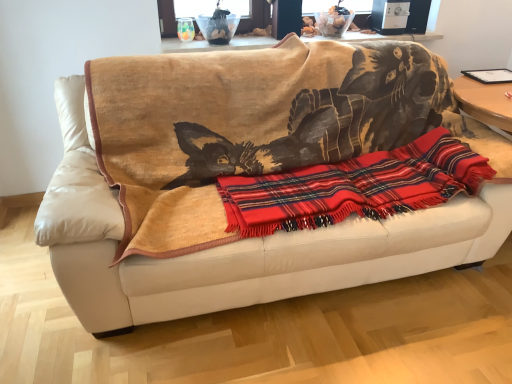
Question: From a real-world perspective, is red plaid blanket at center physically above wooden table at upper center?

Choices:
 (A) no
 (B) yes

Answer: (A)

Question: Is red plaid blanket at center next to wooden table at upper center and touching it?

Choices:
 (A) yes
 (B) no

Answer: (B)

Question: Is red plaid blanket at center oriented towards wooden table at upper center?

Choices:
 (A) yes
 (B) no

Answer: (B)

Question: Is red plaid blanket at center turned away from wooden table at upper center?

Choices:
 (A) yes
 (B) no

Answer: (B)

Question: From a real-world perspective, is red plaid blanket at center beneath wooden table at upper center?

Choices:
 (A) yes
 (B) no

Answer: (A)

Question: Does red plaid blanket at center appear on the left side of wooden table at upper center?

Choices:
 (A) yes
 (B) no

Answer: (B)

Question: Considering the relative positions of red plaid blanket at center and beige leather couch at center in the image provided, is red plaid blanket at center to the right of beige leather couch at center from the viewer's perspective?

Choices:
 (A) yes
 (B) no

Answer: (A)

Question: From the image's perspective, is red plaid blanket at center beneath beige leather couch at center?

Choices:
 (A) yes
 (B) no

Answer: (A)

Question: Is red plaid blanket at center closer to camera compared to beige leather couch at center?

Choices:
 (A) yes
 (B) no

Answer: (B)

Question: Is red plaid blanket at center not within beige leather couch at center?

Choices:
 (A) no
 (B) yes

Answer: (A)

Question: Is red plaid blanket at center taller than beige leather couch at center?

Choices:
 (A) yes
 (B) no

Answer: (B)

Question: Is the depth of red plaid blanket at center greater than that of beige leather couch at center?

Choices:
 (A) yes
 (B) no

Answer: (A)

Question: From a real-world perspective, is wooden table at upper center on top of red plaid blanket at center?

Choices:
 (A) no
 (B) yes

Answer: (B)